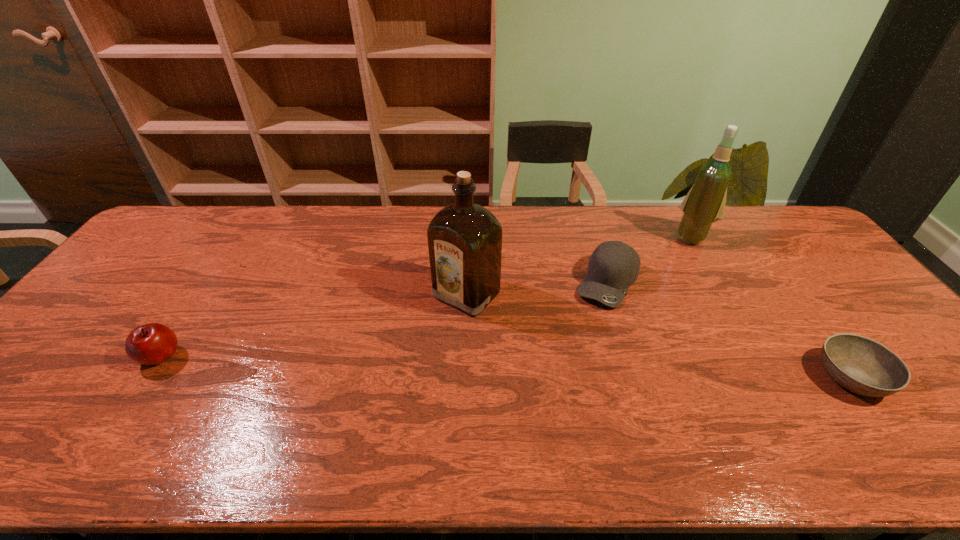
In order to click on apple in this screenshot , I will do `click(153, 343)`.

Where is `the shortest object`? The width and height of the screenshot is (960, 540). the shortest object is located at coordinates (863, 366).

This screenshot has height=540, width=960. Find the location of `bowl`. bowl is located at coordinates (863, 366).

At what (x,y) coordinates should I click in order to perform the action: click on baseball cap. Please return your answer as a coordinate pair (x, y). Looking at the image, I should click on (613, 267).

Find the location of a particular element. wine bottle is located at coordinates (704, 204).

Image resolution: width=960 pixels, height=540 pixels. Find the location of `the farthest object`. the farthest object is located at coordinates (704, 204).

I want to click on liquor, so click(x=464, y=239).

The width and height of the screenshot is (960, 540). In order to click on free region located on the front of the apple in this screenshot , I will do `click(129, 406)`.

I want to click on free region located on the back of the bowl, so click(x=789, y=293).

At what (x,y) coordinates should I click in order to perform the action: click on free point located 0.220m on the front brim of the third object from left to right. Please return your answer as a coordinate pair (x, y). This screenshot has width=960, height=540. Looking at the image, I should click on (573, 364).